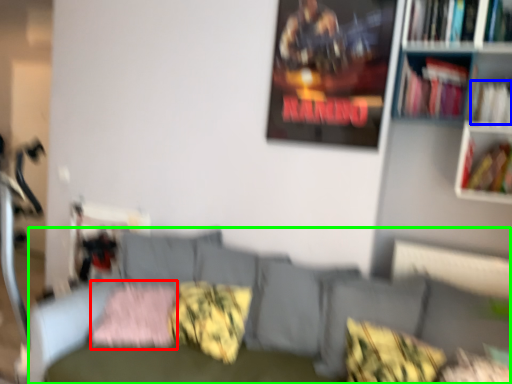
Question: Which object is positioned closest to pillow (highlighted by a red box)? Select from book (highlighted by a blue box) and couch (highlighted by a green box).

Choices:
 (A) book
 (B) couch

Answer: (B)